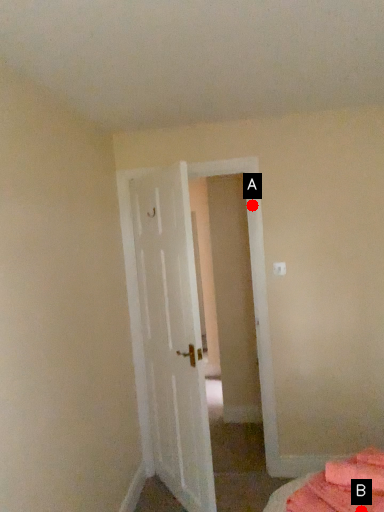
Question: Two points are circled on the image, labeled by A and B beside each circle. Which point is farther to the camera?

Choices:
 (A) A is further
 (B) B is further

Answer: (A)